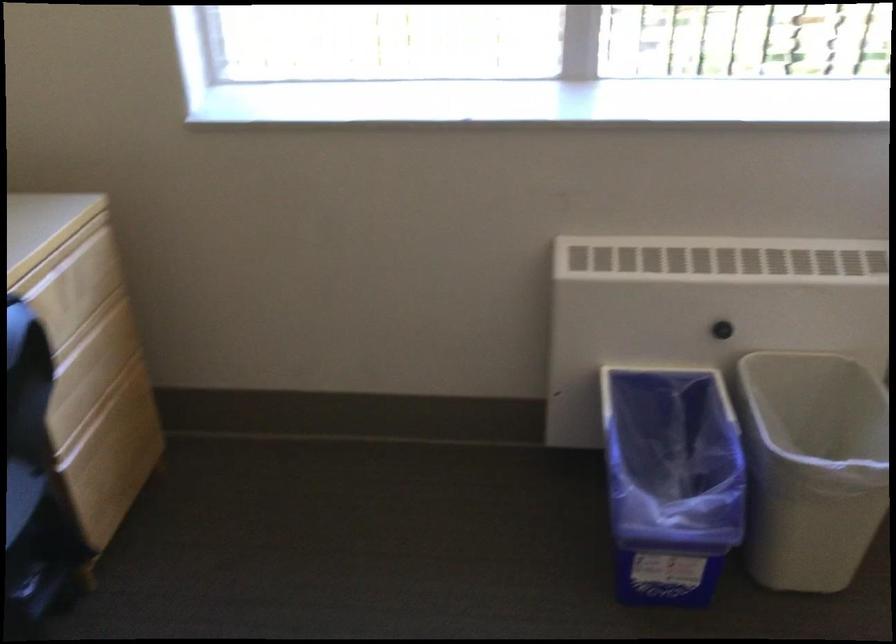
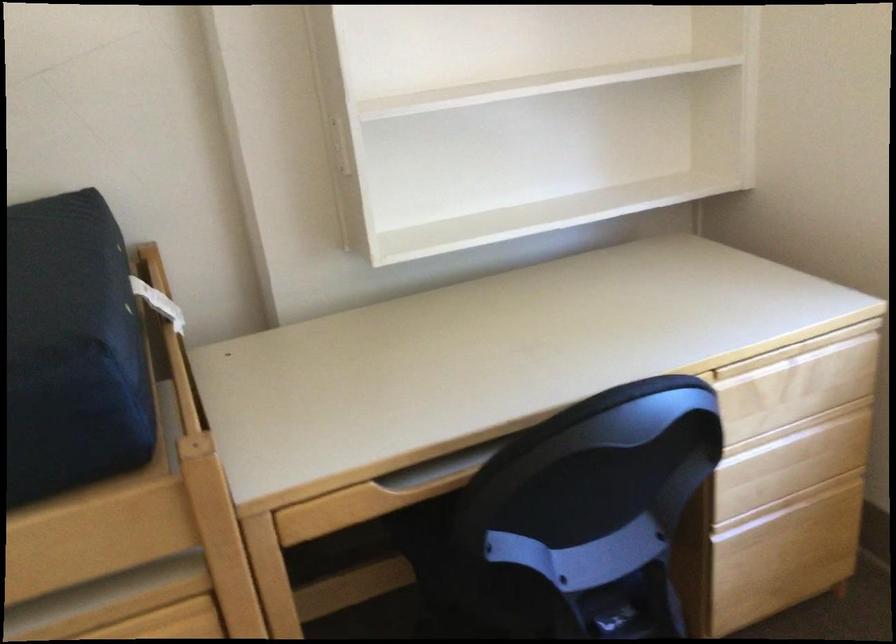
The point at (x=133, y=408) is marked in the first image. Where is the corresponding point in the second image?

(815, 514)